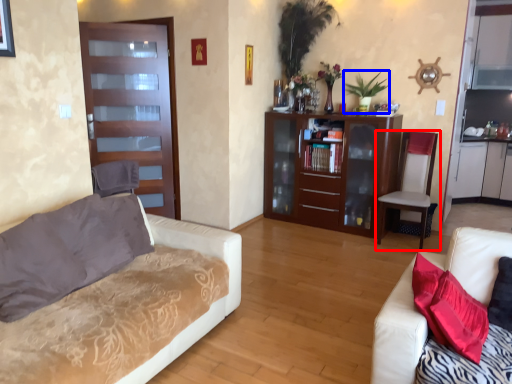
Question: Which of the following is the closest to the observer, chair (highlighted by a red box) or plant (highlighted by a blue box)?

Choices:
 (A) chair
 (B) plant

Answer: (A)